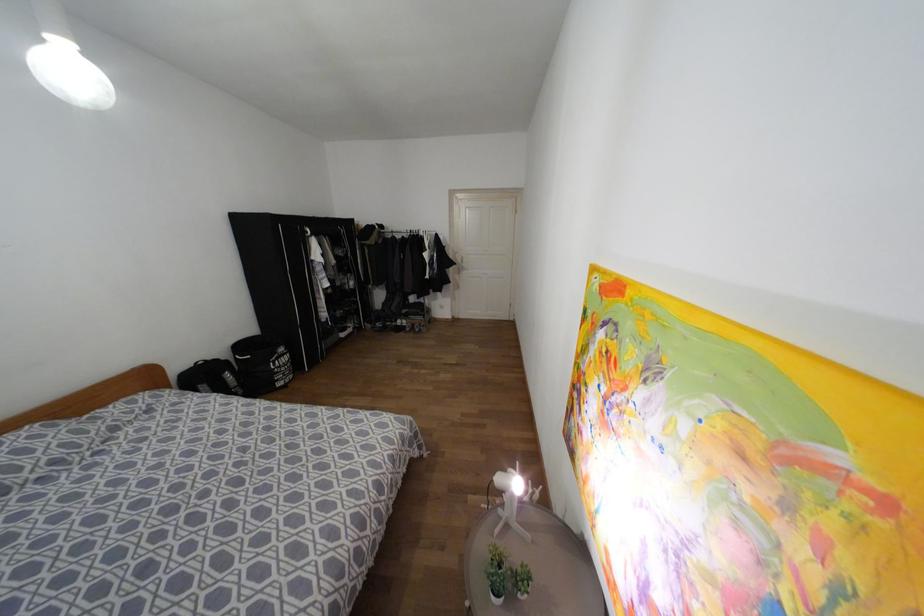
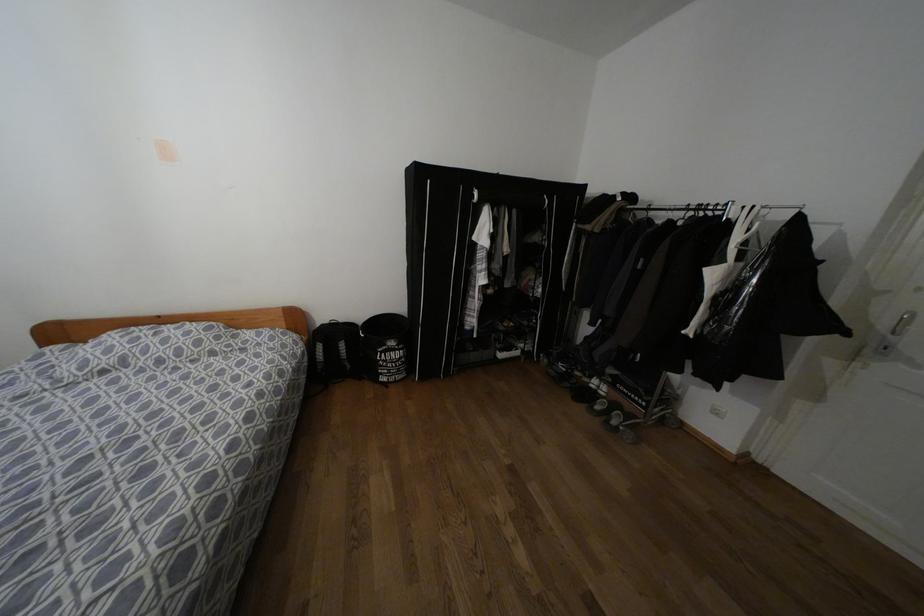
Where in the second image is the point corresponding to the point at 226,376 from the first image?

(342, 345)